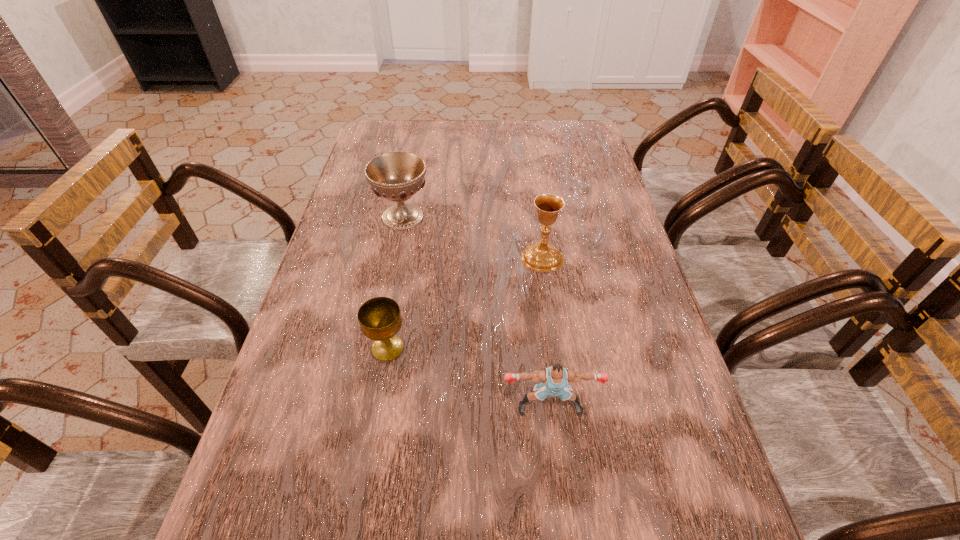
Find the location of `blank region between the nearest object and the third farthest object`. blank region between the nearest object and the third farthest object is located at coordinates [x=468, y=378].

Image resolution: width=960 pixels, height=540 pixels. In order to click on vacant region between the farthest object and the second nearest object in this screenshot , I will do `click(396, 282)`.

I want to click on vacant area between the nearest object and the shortest object, so click(x=468, y=378).

What are the coordinates of `free space between the shortest chalice and the second farthest chalice` in the screenshot? It's located at (465, 302).

Where is `free space between the rightmost chalice and the nearest object`? free space between the rightmost chalice and the nearest object is located at coordinates (546, 332).

Identify the location of free point between the puncher and the rightmost chalice. This screenshot has width=960, height=540. (546, 332).

Select which object is the third closest to the nearest object. Please provide its 2D coordinates. Your answer should be formatted as a tuple, i.e. [(x, y)], where the tuple contains the x and y coordinates of a point satisfying the conditions above.

[(397, 176)]

This screenshot has width=960, height=540. Find the location of `the third closest object to the third farthest object`. the third closest object to the third farthest object is located at coordinates (397, 176).

Locate an element on the screen. This screenshot has height=540, width=960. the closest chalice to the farthest object is located at coordinates (541, 256).

Choose which chalice is the second nearest neighbor to the nearest object. Please provide its 2D coordinates. Your answer should be formatted as a tuple, i.e. [(x, y)], where the tuple contains the x and y coordinates of a point satisfying the conditions above.

[(541, 256)]